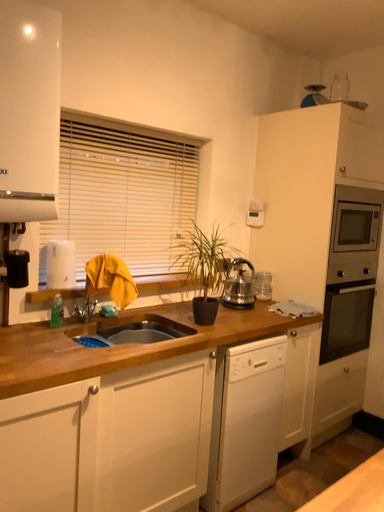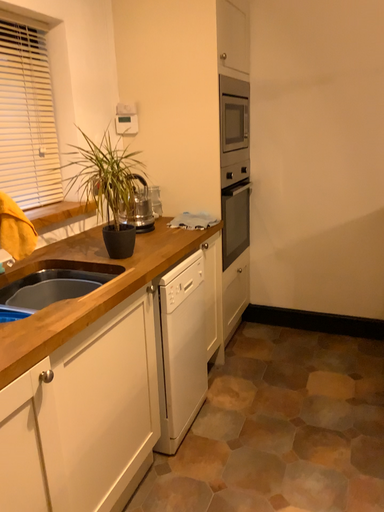
Question: Which way did the camera rotate in the video?

Choices:
 (A) rotated right
 (B) rotated left

Answer: (A)